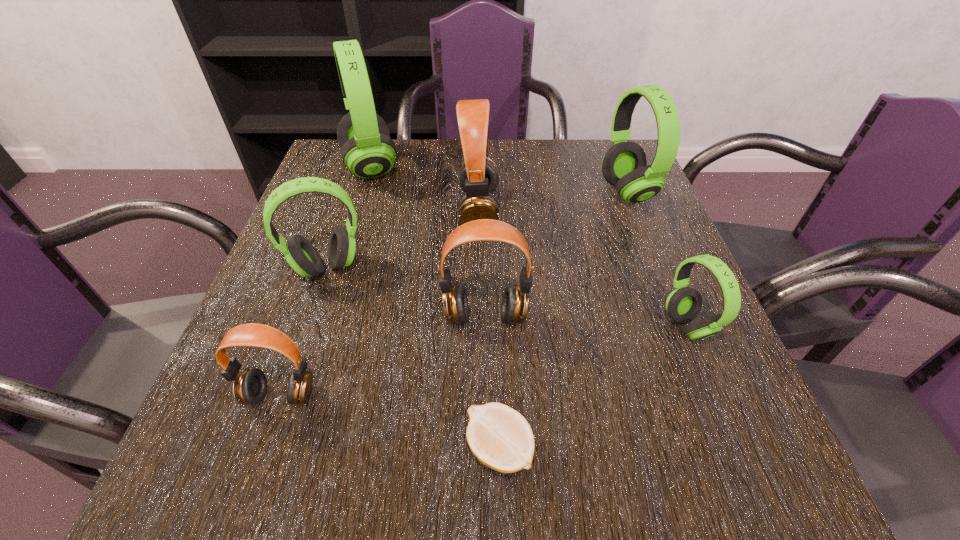
Image resolution: width=960 pixels, height=540 pixels. I want to click on yellow lemon, so click(500, 437).

At what (x,y) coordinates should I click in order to perform the action: click on the shortest object. Please return your answer as a coordinate pair (x, y). This screenshot has width=960, height=540. Looking at the image, I should click on (500, 437).

Find the location of a particular element. Image resolution: width=960 pixels, height=540 pixels. free spot located on the front of the biggest green headset is located at coordinates (339, 269).

I want to click on blank space located 0.300m on the ear cups of the farthest brown headset, so click(626, 209).

In order to click on vacant region located 0.370m on the left of the third smallest green headset in this screenshot , I will do `click(449, 192)`.

The width and height of the screenshot is (960, 540). I want to click on vacant space located 0.390m on the back of the fourth farthest headset, so click(x=367, y=153).

This screenshot has height=540, width=960. I want to click on free space located on the ear cups of the second biggest brown headset, so click(487, 501).

The width and height of the screenshot is (960, 540). Find the location of `free point located 0.060m on the back of the smallest green headset`. free point located 0.060m on the back of the smallest green headset is located at coordinates pos(667,278).

The width and height of the screenshot is (960, 540). I want to click on vacant space situated 0.070m on the ear cups of the smallest brown headset, so click(x=259, y=457).

Find the location of a particular element. The width and height of the screenshot is (960, 540). vacant space located 0.350m on the back of the nearest object is located at coordinates (493, 260).